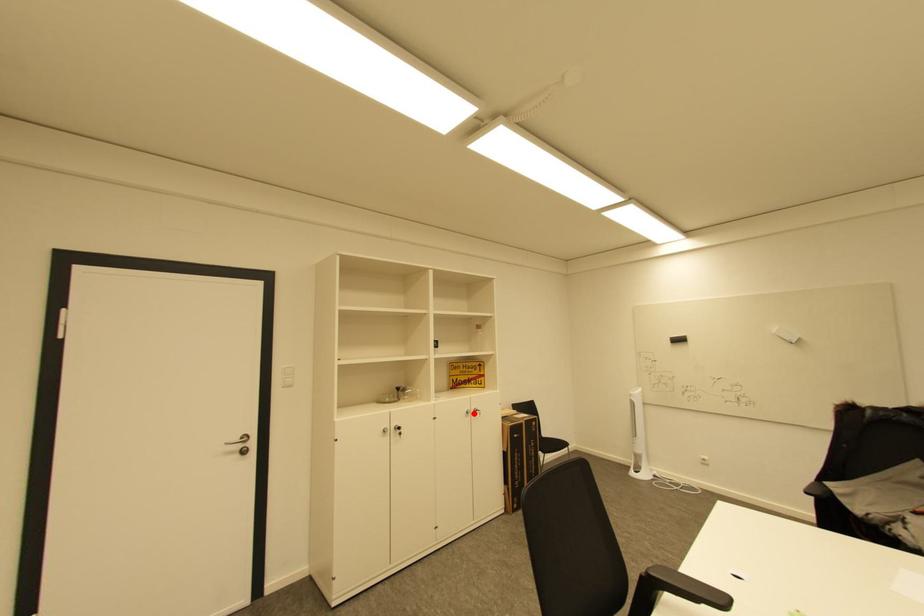
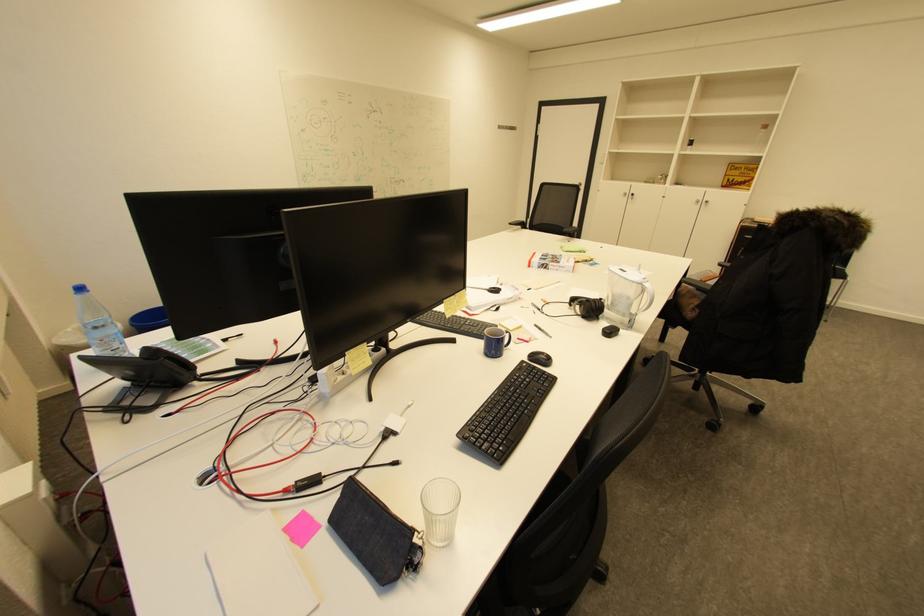
Find the pixel in the second image that matches the highlighted location in the first image.

(703, 201)